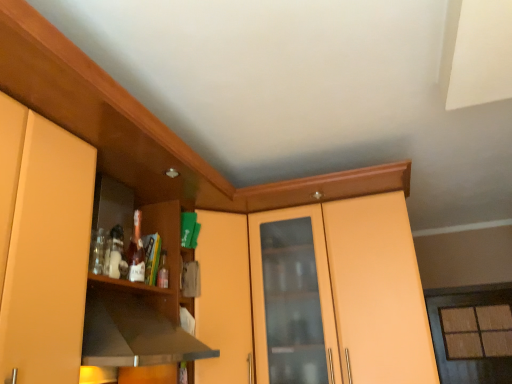
Question: Is black matte exhaust hood at left wider or thinner than matte glass window at right?

Choices:
 (A) wide
 (B) thin

Answer: (A)

Question: Considering the relative positions of black matte exhaust hood at left and matte glass window at right in the image provided, is black matte exhaust hood at left to the left or to the right of matte glass window at right?

Choices:
 (A) right
 (B) left

Answer: (B)

Question: Which is nearer to the matte wood cabinet at center?

Choices:
 (A) matte glass window at right
 (B) translucent glass bottle at shelf center
 (C) black matte exhaust hood at left
 (D) matte yellow cabinet at left

Answer: (C)

Question: Which is nearer to the black matte exhaust hood at left?

Choices:
 (A) matte yellow cabinet at left
 (B) translucent glass bottle at shelf center
 (C) matte wood cabinet at center
 (D) matte glass window at right

Answer: (A)